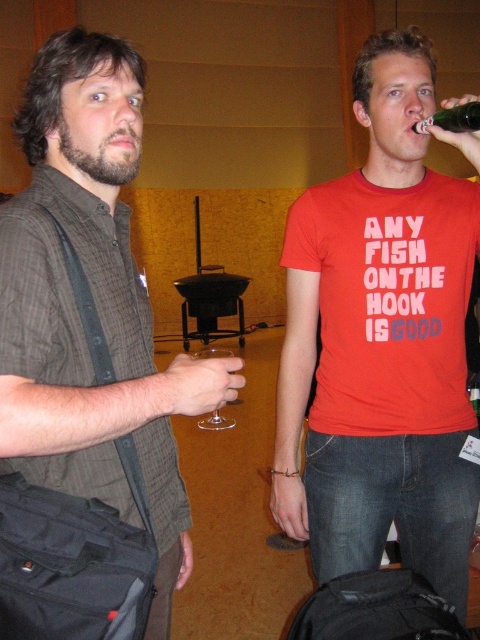
Question: Which object is closer to the camera taking this photo?

Choices:
 (A) clear glass wine at upper right
 (B) matte red t-shirt at center

Answer: (A)

Question: Which object is farther from the camera taking this photo?

Choices:
 (A) clear glass wine at upper right
 (B) matte black shirt at left
 (C) transparent glass at center
 (D) matte red t-shirt at center

Answer: (C)

Question: Does matte red t-shirt at center have a larger size compared to clear glass wine at upper right?

Choices:
 (A) no
 (B) yes

Answer: (B)

Question: Can you confirm if matte black shirt at left is positioned above clear glass wine at upper right?

Choices:
 (A) yes
 (B) no

Answer: (B)

Question: Among these points, which one is farthest from the camera?

Choices:
 (A) (428, 129)
 (B) (417, 84)

Answer: (B)

Question: Is clear glass wine at upper right wider than transparent glass at center?

Choices:
 (A) no
 (B) yes

Answer: (A)